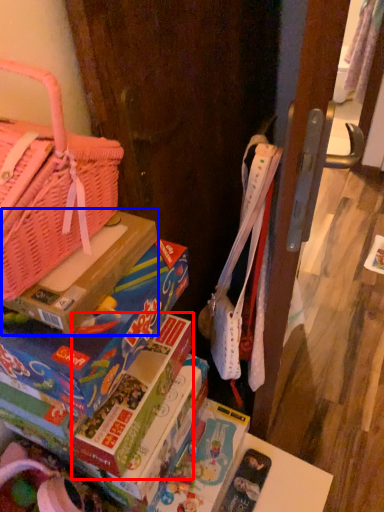
Question: Which object is closer to the camera taking this photo, paperback book (highlighted by a red box) or cardboard box (highlighted by a blue box)?

Choices:
 (A) paperback book
 (B) cardboard box

Answer: (B)